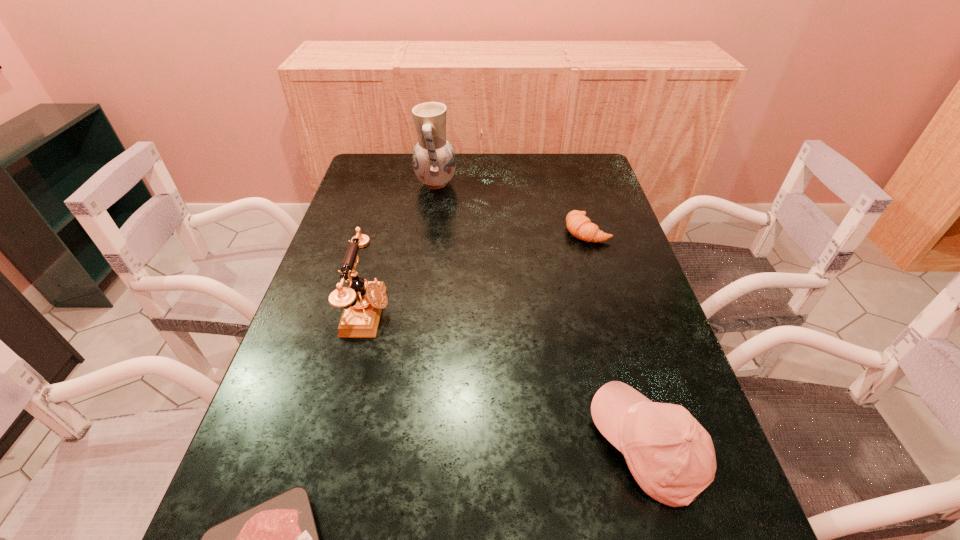
This screenshot has height=540, width=960. I want to click on vacant space at the far right corner of the desktop, so click(x=600, y=166).

I want to click on free space between the tallest object and the telephone, so click(x=401, y=248).

At what (x,y) coordinates should I click in order to perform the action: click on vacant region between the second shortest object and the baseball cap. Please return your answer as a coordinate pair (x, y). Looking at the image, I should click on (616, 339).

Find the location of a particular element. This screenshot has width=960, height=540. free point between the farthest object and the third shortest object is located at coordinates (541, 315).

What are the coordinates of `free space between the telephone and the farthest object` in the screenshot? It's located at (401, 248).

The image size is (960, 540). I want to click on free spot between the second shortest object and the baseball cap, so click(616, 339).

Locate an element on the screen. The width and height of the screenshot is (960, 540). free space between the farthest object and the third shortest object is located at coordinates (541, 315).

Locate an element on the screen. This screenshot has width=960, height=540. free space between the second farthest object and the third tallest object is located at coordinates (616, 339).

Find the location of a particular element. The image size is (960, 540). object identified as the second closest to the steak is located at coordinates (671, 456).

Find the location of a particular element. Image resolution: width=960 pixels, height=540 pixels. object that is the fourth closest to the fourth nearest object is located at coordinates (277, 539).